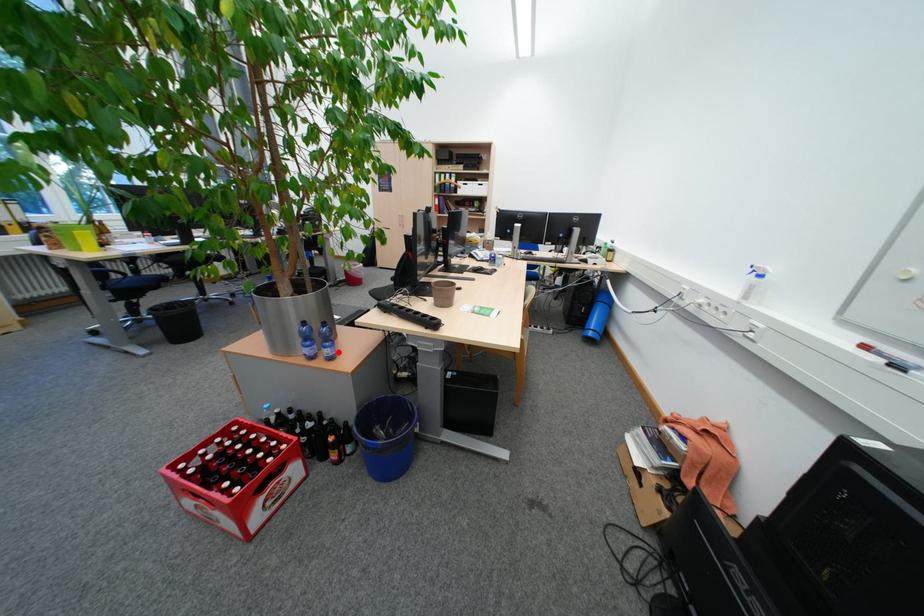
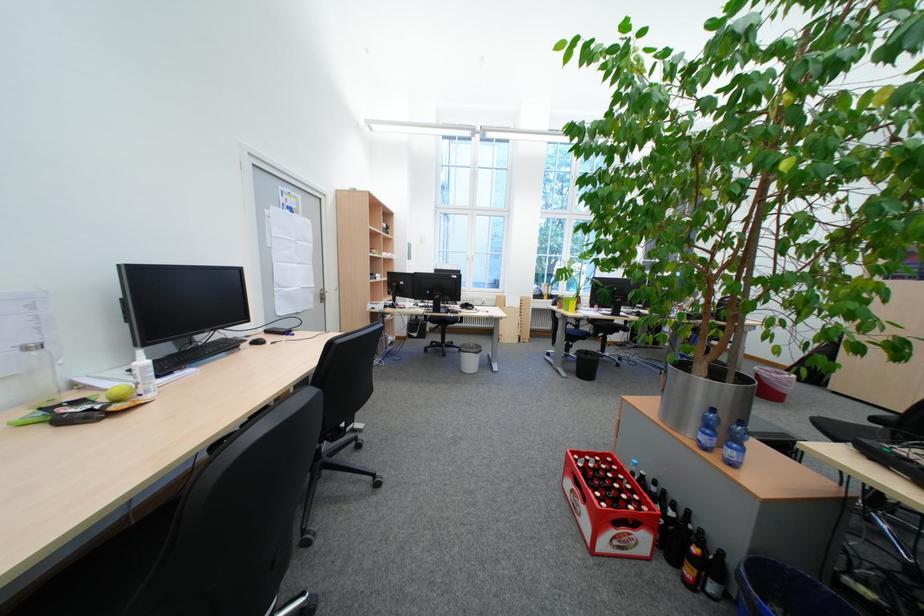
Find the pixel in the second image that matches the highlighted location in the first image.

(743, 454)